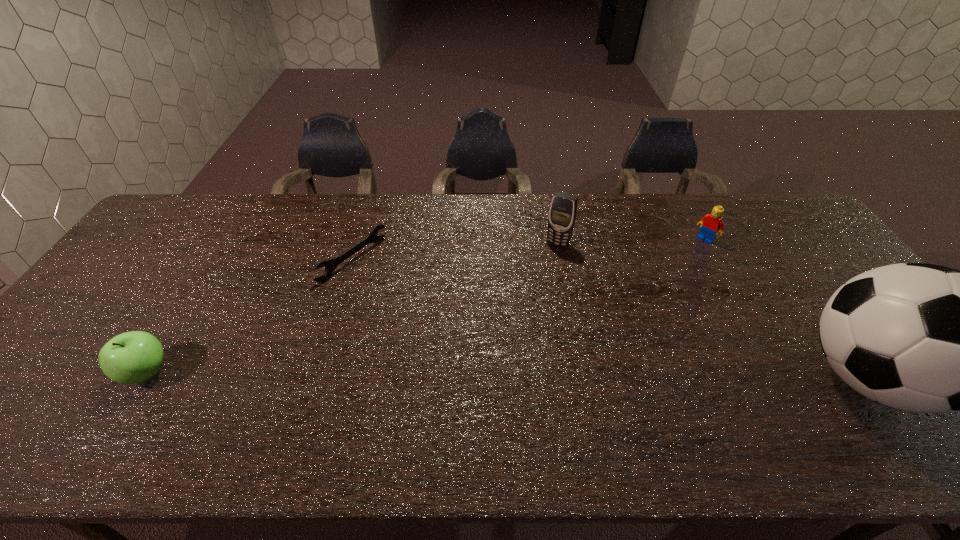
This screenshot has width=960, height=540. What are the coordinates of `vacant region located on the front face of the second tallest object` in the screenshot? It's located at (532, 289).

Locate an element on the screen. free location located 0.220m on the front face of the second tallest object is located at coordinates (528, 296).

I want to click on vacant space positioned on the front face of the second tallest object, so click(543, 267).

The height and width of the screenshot is (540, 960). What are the coordinates of `vacant space located 0.330m on the open ends of the wrench` in the screenshot? It's located at (459, 330).

Find the location of `free location located on the open ends of the wrench`. free location located on the open ends of the wrench is located at coordinates (x=412, y=301).

Image resolution: width=960 pixels, height=540 pixels. I want to click on vacant space located on the open ends of the wrench, so click(x=442, y=319).

This screenshot has height=540, width=960. I want to click on Lego that is at the far edge, so click(710, 224).

What are the coordinates of `wrench at the far edge` in the screenshot? It's located at (330, 265).

This screenshot has width=960, height=540. I want to click on object located at the near edge, so click(134, 357).

Find the location of `vacant space at the far edge of the desktop`. vacant space at the far edge of the desktop is located at coordinates (343, 220).